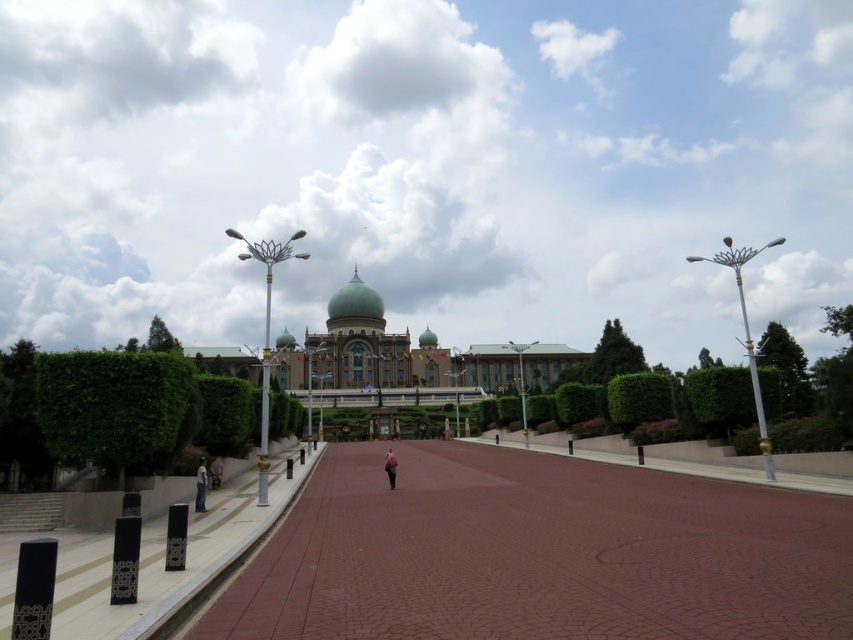
You are standing in the plaza and need to decide whether to place a new bench between the green leafy hedge at left and the light brown leather jacket at center. Which object should you consider for spacing because it is wider?

The green leafy hedge at left might be wider than the light brown leather jacket at center, so you should consider the green leafy hedge at left for spacing.